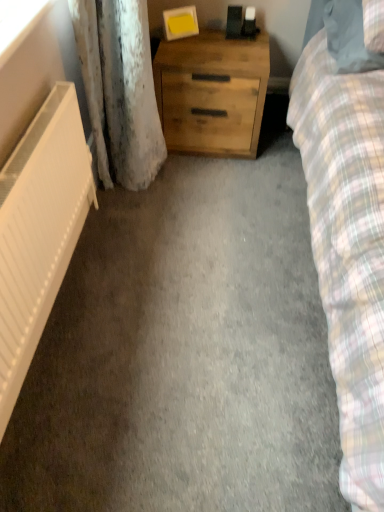
Find the location of a particular element. transparent plastic window screen at upper left is located at coordinates (18, 23).

Is natural wood chest of drawers at center positioned with its back to plaid fabric pillow at upper right?

That's not correct — natural wood chest of drawers at center is not looking away from plaid fabric pillow at upper right.

Is point (174, 82) farther from viewer compared to point (326, 27)?

Yes, point (174, 82) is behind point (326, 27).

Where is `the chest of drawers that appears below the plaid fabric pillow at upper right (from the image's perspective)`? The width and height of the screenshot is (384, 512). the chest of drawers that appears below the plaid fabric pillow at upper right (from the image's perspective) is located at coordinates (212, 93).

From a real-world perspective, is natural wood chest of drawers at center positioned over plaid fabric pillow at upper right based on gravity?

No, from a real-world perspective, natural wood chest of drawers at center is not over plaid fabric pillow at upper right

How many degrees apart are the facing directions of white matte radiator at left and transparent plastic window screen at upper left?

The angle between the facing direction of white matte radiator at left and the facing direction of transparent plastic window screen at upper left is 0.414 degrees.

Is the position of white matte radiator at left more distant than that of transparent plastic window screen at upper left?

No, white matte radiator at left is closer to the viewer.

Does point (80, 121) appear closer or farther from the camera than point (8, 23)?

Clearly, point (80, 121) is more distant from the camera than point (8, 23).

Looking at their sizes, would you say white matte radiator at left is wider or thinner than transparent plastic window screen at upper left?

white matte radiator at left is thinner than transparent plastic window screen at upper left.

Is natural wood chest of drawers at center positioned far away from transparent plastic window screen at upper left?

They are positioned close to each other.

What are the coordinates of `chest of drawers on the right of transparent plastic window screen at upper left` in the screenshot? It's located at (212, 93).

From the image's perspective, relative to transparent plastic window screen at upper left, is natural wood chest of drawers at center above or below?

natural wood chest of drawers at center is situated higher than transparent plastic window screen at upper left in the image.

Considering the points (216, 110) and (11, 28), which point is behind, point (216, 110) or point (11, 28)?

Positioned behind is point (216, 110).

From the image's perspective, between white matte radiator at left and natural wood chest of drawers at center, which one is located above?

From the image's view, natural wood chest of drawers at center is above.

Are white matte radiator at left and natural wood chest of drawers at center located far from each other?

No, white matte radiator at left is in close proximity to natural wood chest of drawers at center.

From a real-world perspective, which is physically below, white matte radiator at left or natural wood chest of drawers at center?

white matte radiator at left, from a real-world perspective.

Considering the sizes of white matte radiator at left and natural wood chest of drawers at center in the image, is white matte radiator at left taller or shorter than natural wood chest of drawers at center?

Considering their sizes, white matte radiator at left has less height than natural wood chest of drawers at center.

Is transparent plastic window screen at upper left taller or shorter than white matte radiator at left?

Considering their sizes, transparent plastic window screen at upper left has less height than white matte radiator at left.

Does point (31, 30) appear closer or farther from the camera than point (40, 197)?

Point (31, 30) is farther from the camera than point (40, 197).

How different are the orientations of transparent plastic window screen at upper left and white matte radiator at left in degrees?

The facing directions of transparent plastic window screen at upper left and white matte radiator at left are 0.414 degrees apart.

Would you say transparent plastic window screen at upper left is outside white matte radiator at left?

transparent plastic window screen at upper left is positioned outside white matte radiator at left.

Is transparent plastic window screen at upper left looking in the opposite direction of natural wood chest of drawers at center?

transparent plastic window screen at upper left does not have its back to natural wood chest of drawers at center.

Considering the relative sizes of transparent plastic window screen at upper left and natural wood chest of drawers at center in the image provided, is transparent plastic window screen at upper left thinner than natural wood chest of drawers at center?

Yes.

Considering the relative sizes of transparent plastic window screen at upper left and natural wood chest of drawers at center in the image provided, is transparent plastic window screen at upper left shorter than natural wood chest of drawers at center?

Yes, transparent plastic window screen at upper left is shorter than natural wood chest of drawers at center.

Can you tell me how much plaid fabric pillow at upper right and transparent plastic window screen at upper left differ in facing direction?

They differ by 88.2 degrees in their facing directions.

Can transparent plastic window screen at upper left be found inside plaid fabric pillow at upper right?

No, transparent plastic window screen at upper left is not a part of plaid fabric pillow at upper right.

Considering the sizes of objects plaid fabric pillow at upper right and transparent plastic window screen at upper left in the image provided, who is shorter, plaid fabric pillow at upper right or transparent plastic window screen at upper left?

transparent plastic window screen at upper left.

Which object is further away from the camera taking this photo, plaid fabric pillow at upper right or transparent plastic window screen at upper left?

plaid fabric pillow at upper right is further from the camera.

You are a GUI agent. You are given a task and a screenshot of the screen. Output one action in this format:
    pyautogui.click(x=<x>, y=<y>)
    Task: Click on the chest of drawers lying on the left of plaid fabric pillow at upper right
    The width and height of the screenshot is (384, 512).
    Given the screenshot: What is the action you would take?
    click(x=212, y=93)

What are the coordinates of `radiator below the transparent plastic window screen at upper left (from a real-world perspective)` in the screenshot? It's located at pos(39,230).

In the scene shown: Looking at the image, which one is located further to plaid fabric pillow at upper right, transparent plastic window screen at upper left or white matte radiator at left?

white matte radiator at left.

Looking at this image, from the image, which object appears to be farther from transparent plastic window screen at upper left, white matte radiator at left or natural wood chest of drawers at center?

natural wood chest of drawers at center is positioned further to the anchor transparent plastic window screen at upper left.

Considering their positions, is natural wood chest of drawers at center positioned closer to white matte radiator at left than transparent plastic window screen at upper left?

transparent plastic window screen at upper left lies closer to white matte radiator at left than the other object.

From the image, which object appears to be nearer to white matte radiator at left, natural wood chest of drawers at center or plaid fabric pillow at upper right?

Based on the image, natural wood chest of drawers at center appears to be nearer to white matte radiator at left.

Estimate the real-world distances between objects in this image. Which object is closer to natural wood chest of drawers at center, white matte radiator at left or transparent plastic window screen at upper left?

white matte radiator at left lies closer to natural wood chest of drawers at center than the other object.

Based on the photo, when comparing their distances from plaid fabric pillow at upper right, does white matte radiator at left or natural wood chest of drawers at center seem closer?

The object closer to plaid fabric pillow at upper right is natural wood chest of drawers at center.

Based on their spatial positions, is natural wood chest of drawers at center or plaid fabric pillow at upper right closer to transparent plastic window screen at upper left?

natural wood chest of drawers at center.

Looking at the image, which one is located further to white matte radiator at left, transparent plastic window screen at upper left or plaid fabric pillow at upper right?

plaid fabric pillow at upper right is further to white matte radiator at left.

You are a GUI agent. You are given a task and a screenshot of the screen. Output one action in this format:
    pyautogui.click(x=<x>, y=<y>)
    Task: Click on the chest of drawers between white matte radiator at left and plaid fabric pillow at upper right from left to right
    The width and height of the screenshot is (384, 512).
    Given the screenshot: What is the action you would take?
    pyautogui.click(x=212, y=93)

This screenshot has height=512, width=384. Find the location of `chest of drawers between transparent plastic window screen at upper left and plaid fabric pillow at upper right in the horizontal direction`. chest of drawers between transparent plastic window screen at upper left and plaid fabric pillow at upper right in the horizontal direction is located at coordinates (212, 93).

Where is `window screen between white matte radiator at left and natural wood chest of drawers at center along the z-axis`? window screen between white matte radiator at left and natural wood chest of drawers at center along the z-axis is located at coordinates pyautogui.click(x=18, y=23).

In order to click on radiator situated between transparent plastic window screen at upper left and plaid fabric pillow at upper right from left to right in this screenshot , I will do `click(39, 230)`.